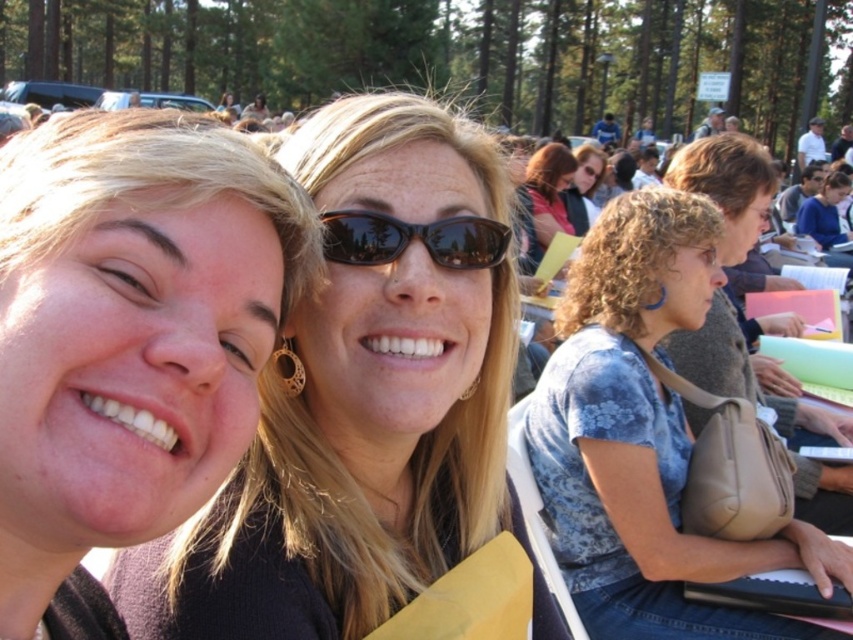
You are standing in the crowd at the event and want to find the blue floral shirt at center. According to the coordinates provided, where should you look relative to the two women in the foreground?

The blue floral shirt at center is located at coordinates point (643,436), which is to the right and slightly above the two women in the foreground.

You are a photographer at the event and need to frame a shot that includes both the matte black hair at left and the blue floral shirt at center. Which object should you adjust your camera angle to prioritize in terms of width to ensure both fit in the frame?

The matte black hair at left has a lesser width compared to the blue floral shirt at center, so you should prioritize framing the wider blue floral shirt at center to ensure both fit in the frame.